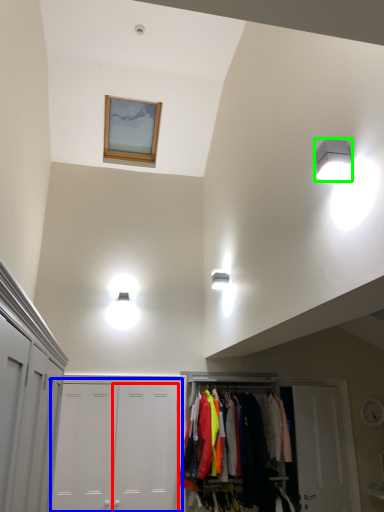
Question: Based on their relative distances, which object is farther from door (highlighted by a red box)? Choose from door (highlighted by a blue box) and light fixture (highlighted by a green box).

Choices:
 (A) door
 (B) light fixture

Answer: (B)